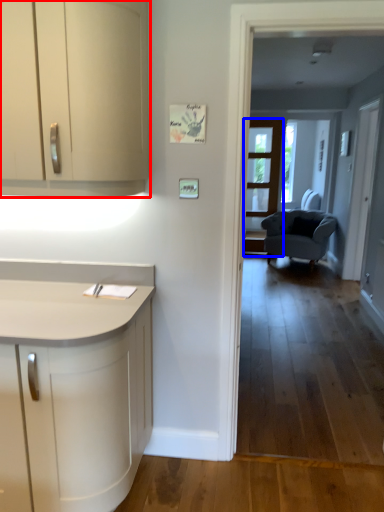
Question: Which object is closer to the camera taking this photo, cabinetry (highlighted by a red box) or screen door (highlighted by a blue box)?

Choices:
 (A) cabinetry
 (B) screen door

Answer: (A)